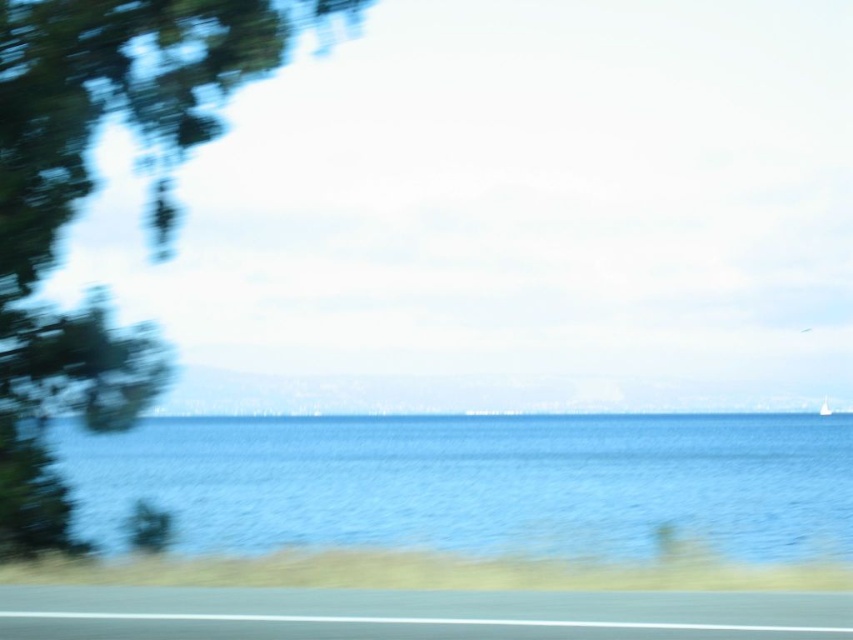
You are a passenger in a car and looking out the window. You see the blue water at center and the smooth asphalt highway at lower center. Which one is closer to you?

The blue water at center is closer to you because the smooth asphalt highway at lower center is behind it.

You are a passenger in a car and notice the blue water at center and the green matte tree at left outside the window. Which object appears bigger in the scene?

The blue water at center appears bigger than the green matte tree at left because it has a larger size in the scene.